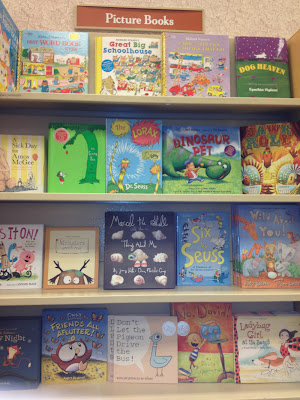
This screenshot has width=300, height=400. Find the location of `yellow book titles`. yellow book titles is located at coordinates (199, 254), (69, 328), (205, 44), (264, 60).